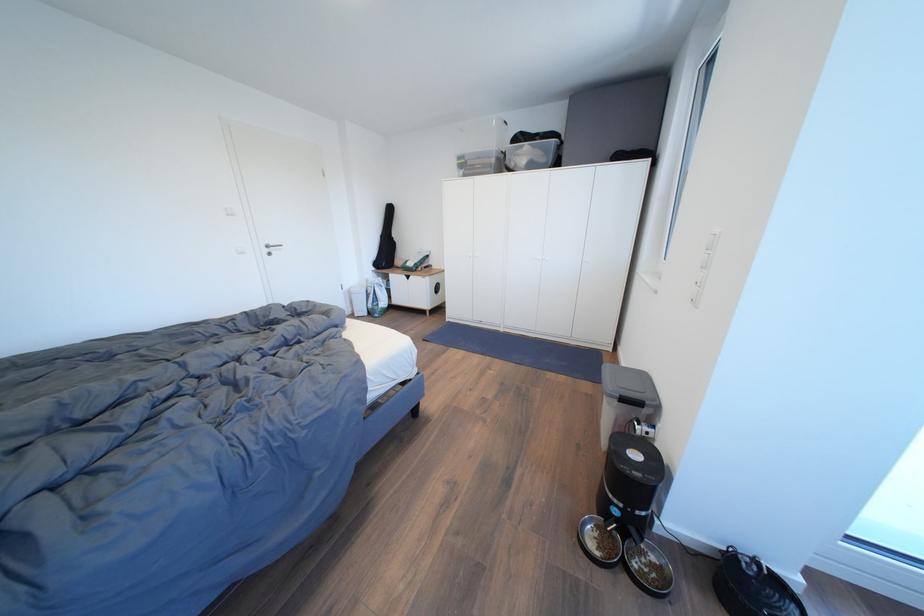
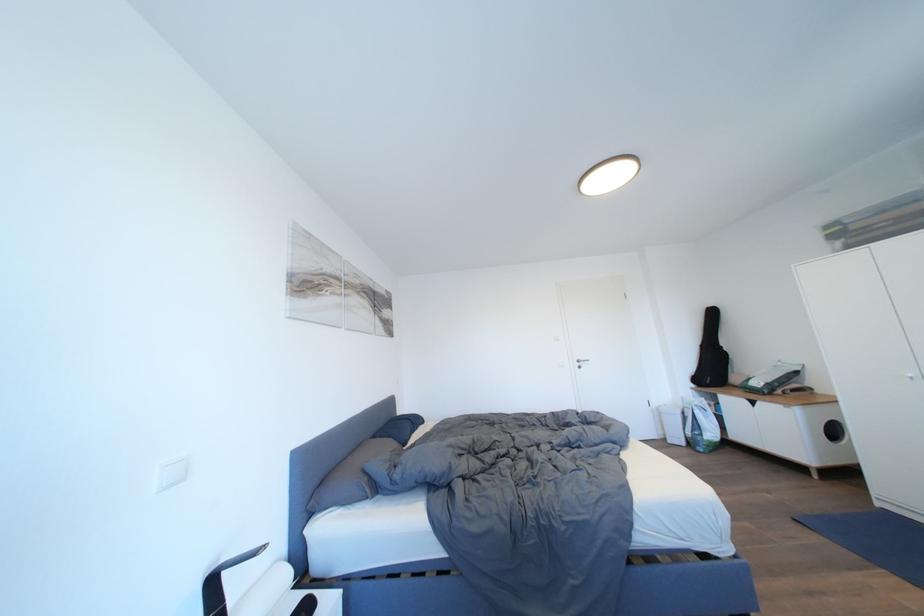
The images are taken continuously from a first-person perspective. In which direction is your viewpoint rotating?

The camera's rotation is toward left-up.